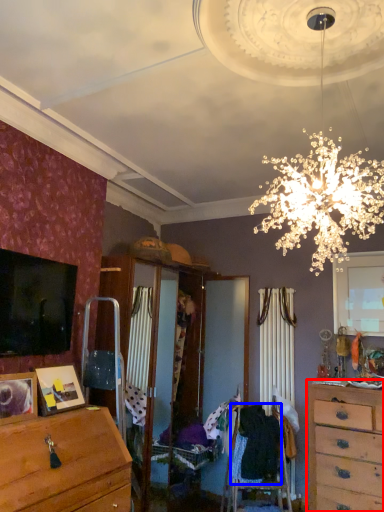
Question: Which point is closer to the camera, chest of drawers (highlighted by a red box) or clothing (highlighted by a blue box)?

Choices:
 (A) chest of drawers
 (B) clothing

Answer: (A)